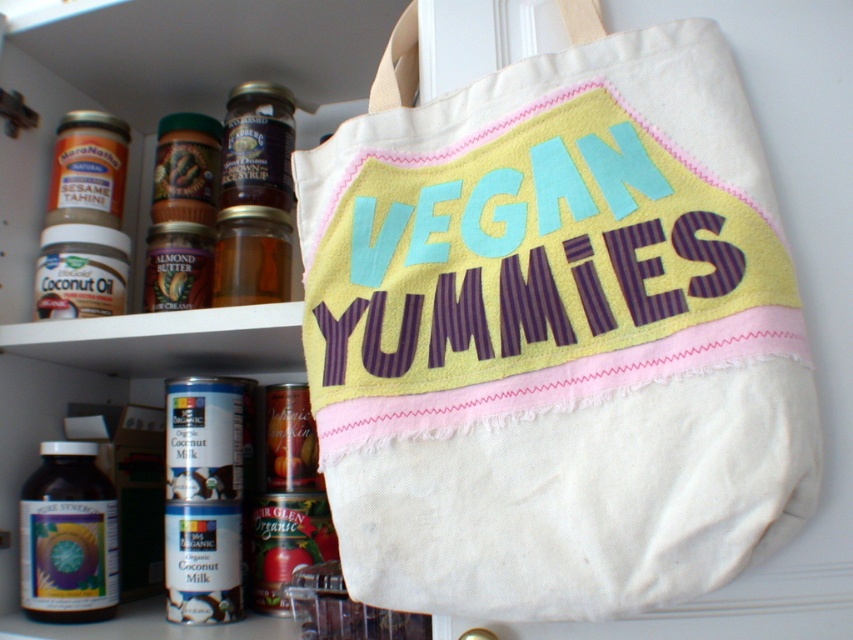
Can you confirm if white canvas tote at center is positioned below translucent glass bottle at lower left?

Actually, white canvas tote at center is above translucent glass bottle at lower left.

Is white canvas tote at center in front of translucent glass bottle at lower left?

Yes, white canvas tote at center is closer to the viewer.

Between point (804, 376) and point (78, 456), which one is positioned behind?

The point (78, 456) is behind.

Find the location of a particular element. The image size is (853, 640). white canvas tote at center is located at coordinates (555, 333).